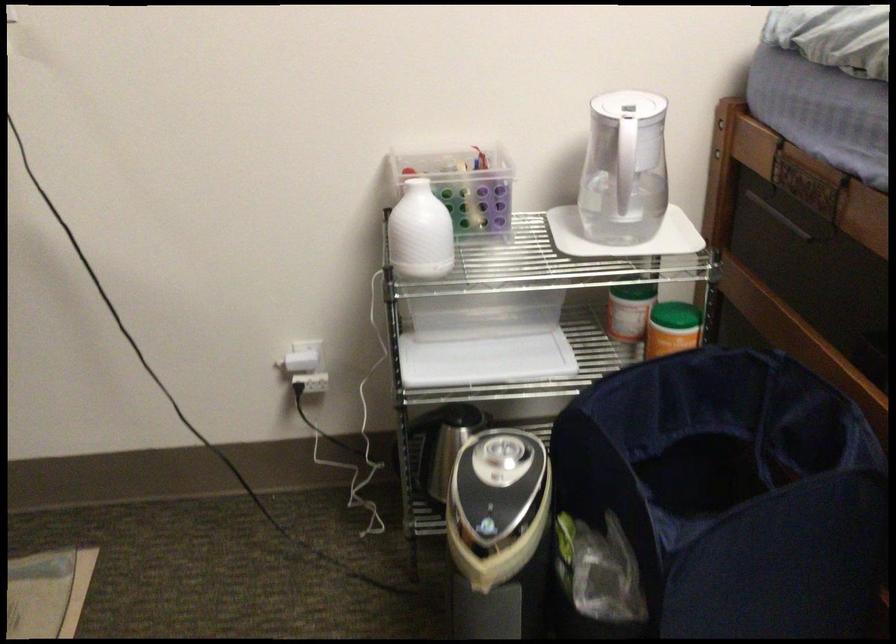
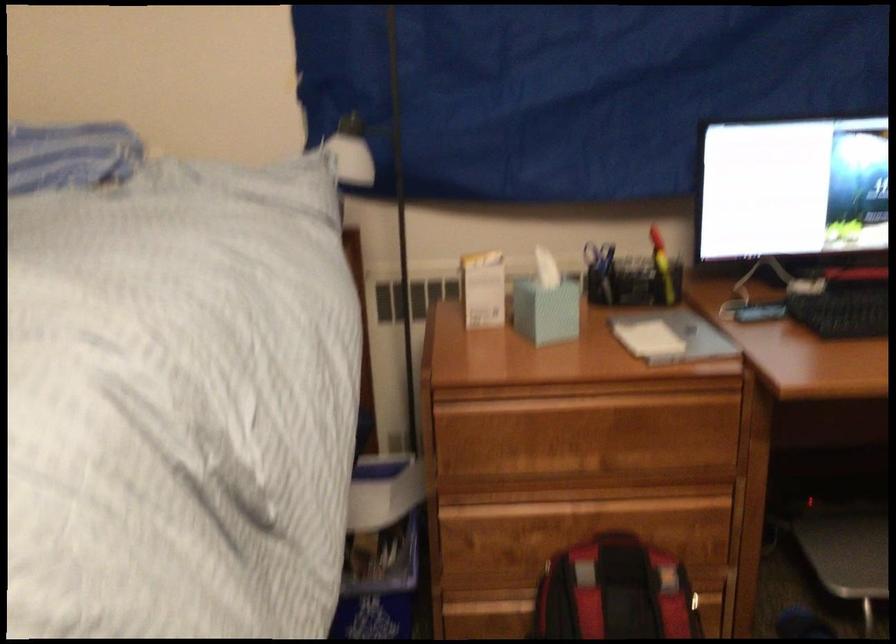
Question: How did the camera likely rotate?

Choices:
 (A) Left
 (B) Right
 (C) Up
 (D) Down

Answer: (B)